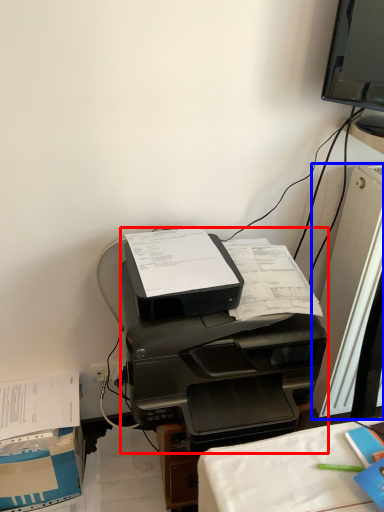
Question: Which of the following is the farthest to the observer, printer (highlighted by a red box) or desktop computer (highlighted by a blue box)?

Choices:
 (A) printer
 (B) desktop computer

Answer: (B)